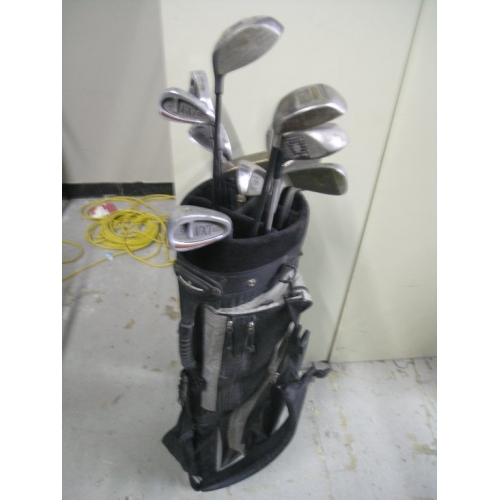
The image size is (500, 500). In order to click on yellow extension cord in this screenshot , I will do `click(141, 239)`.